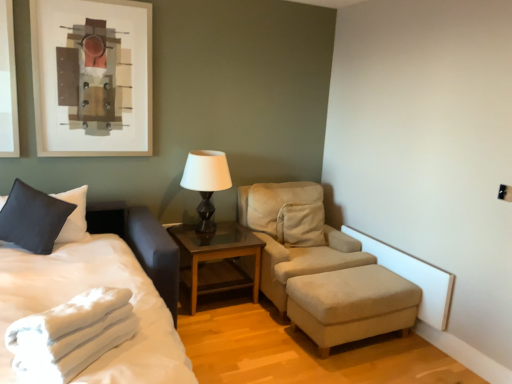
Question: From a real-world perspective, is white soft towel at lower left under beige fabric studio couch at center?

Choices:
 (A) yes
 (B) no

Answer: (B)

Question: Considering the relative positions of white soft towel at lower left and beige fabric studio couch at center in the image provided, is white soft towel at lower left to the left of beige fabric studio couch at center from the viewer's perspective?

Choices:
 (A) yes
 (B) no

Answer: (A)

Question: Is white soft towel at lower left located outside beige fabric studio couch at center?

Choices:
 (A) yes
 (B) no

Answer: (A)

Question: Considering the relative sizes of white soft towel at lower left and beige fabric studio couch at center in the image provided, is white soft towel at lower left wider than beige fabric studio couch at center?

Choices:
 (A) yes
 (B) no

Answer: (B)

Question: From a real-world perspective, is white soft towel at lower left on top of beige fabric studio couch at center?

Choices:
 (A) no
 (B) yes

Answer: (B)

Question: Is white soft towel at lower left placed right next to beige fabric studio couch at center?

Choices:
 (A) yes
 (B) no

Answer: (B)

Question: Is white soft towel at lower left facing away from white soft bed at left?

Choices:
 (A) no
 (B) yes

Answer: (B)

Question: Does white soft towel at lower left have a smaller size compared to white soft bed at left?

Choices:
 (A) no
 (B) yes

Answer: (B)

Question: Is white soft towel at lower left wider than white soft bed at left?

Choices:
 (A) no
 (B) yes

Answer: (A)

Question: Can you confirm if white soft towel at lower left is thinner than white soft bed at left?

Choices:
 (A) no
 (B) yes

Answer: (B)

Question: From a real-world perspective, is white soft towel at lower left physically above white soft bed at left?

Choices:
 (A) no
 (B) yes

Answer: (B)

Question: From the image's perspective, would you say white soft towel at lower left is positioned over white soft bed at left?

Choices:
 (A) yes
 (B) no

Answer: (A)

Question: Is matte black pillow at left oriented away from beige fabric studio couch at center?

Choices:
 (A) no
 (B) yes

Answer: (A)